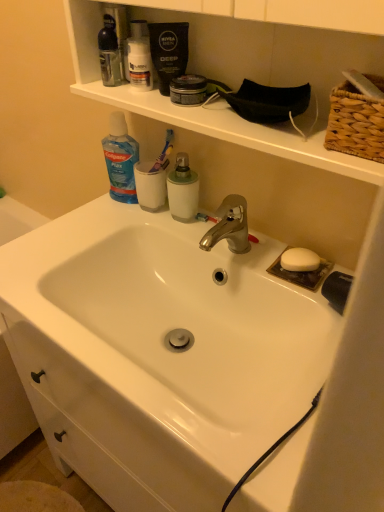
Question: Considering the relative positions of red plastic toothbrush at center, which is the 2th toothbrush from top to bottom, and matte plastic shaving cream canister at upper center in the image provided, is red plastic toothbrush at center, which is the 2th toothbrush from top to bottom, to the left of matte plastic shaving cream canister at upper center from the viewer's perspective?

Choices:
 (A) yes
 (B) no

Answer: (B)

Question: From a real-world perspective, is red plastic toothbrush at center, which is the second toothbrush from left to right, positioned under matte plastic shaving cream canister at upper center based on gravity?

Choices:
 (A) yes
 (B) no

Answer: (A)

Question: Considering the relative sizes of red plastic toothbrush at center, the first toothbrush ordered from the bottom, and matte plastic shaving cream canister at upper center in the image provided, is red plastic toothbrush at center, the first toothbrush ordered from the bottom, wider than matte plastic shaving cream canister at upper center?

Choices:
 (A) no
 (B) yes

Answer: (A)

Question: From the image's perspective, is red plastic toothbrush at center, the first toothbrush ordered from the bottom, beneath matte plastic shaving cream canister at upper center?

Choices:
 (A) yes
 (B) no

Answer: (A)

Question: From a real-world perspective, is red plastic toothbrush at center, the first toothbrush ordered from the bottom, on top of matte plastic shaving cream canister at upper center?

Choices:
 (A) no
 (B) yes

Answer: (A)

Question: From the image's perspective, is red plastic toothbrush at center, the first toothbrush ordered from the bottom, located above or below woven straw basket at upper right?

Choices:
 (A) above
 (B) below

Answer: (B)

Question: From a real-world perspective, is red plastic toothbrush at center, positioned as the 1th toothbrush in right-to-left order, physically located above or below woven straw basket at upper right?

Choices:
 (A) above
 (B) below

Answer: (B)

Question: Is red plastic toothbrush at center, which is the second toothbrush from left to right, inside the boundaries of woven straw basket at upper right, or outside?

Choices:
 (A) inside
 (B) outside

Answer: (B)

Question: In terms of height, does red plastic toothbrush at center, which is the second toothbrush from left to right, look taller or shorter compared to woven straw basket at upper right?

Choices:
 (A) short
 (B) tall

Answer: (A)

Question: Is white glossy sink at center bigger or smaller than white matte mouthwash at center, placed as the 2th mouthwash when sorted from top to bottom?

Choices:
 (A) big
 (B) small

Answer: (A)

Question: Considering the positions of point (127, 268) and point (183, 203), is point (127, 268) closer or farther from the camera than point (183, 203)?

Choices:
 (A) farther
 (B) closer

Answer: (A)

Question: Visually, is white glossy sink at center positioned to the left or to the right of white matte mouthwash at center, placed as the 2th mouthwash when sorted from top to bottom?

Choices:
 (A) left
 (B) right

Answer: (A)

Question: Relative to white matte mouthwash at center, the first mouthwash from the right, is white glossy sink at center in front or behind?

Choices:
 (A) behind
 (B) front

Answer: (B)

Question: Visually, is white glossy sink at center positioned to the left or to the right of translucent plastic mouthwash at upper left, arranged as the second mouthwash when viewed from the right?

Choices:
 (A) right
 (B) left

Answer: (A)

Question: Considering their positions, is white glossy sink at center located in front of or behind translucent plastic mouthwash at upper left, positioned as the first mouthwash in left-to-right order?

Choices:
 (A) behind
 (B) front

Answer: (B)